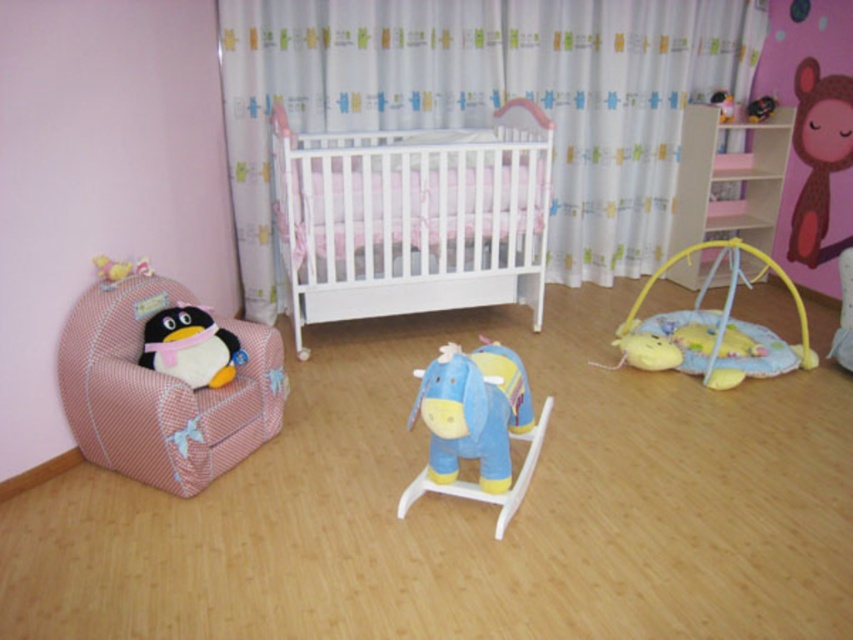
You are a parent looking for a toy for your child. You see the matte plush penguin at left and the matte black monkey at upper right. Which toy is positioned to the left of the other?

The matte plush penguin at left is positioned to the left of the matte black monkey at upper right.

You are a parent looking for a toy for your child in the children room. You see the matte plush penguin at left and the matte black monkey at upper right. Which toy is located lower in the room?

The matte plush penguin at left is located lower in the room because it is below the matte black monkey at upper right.